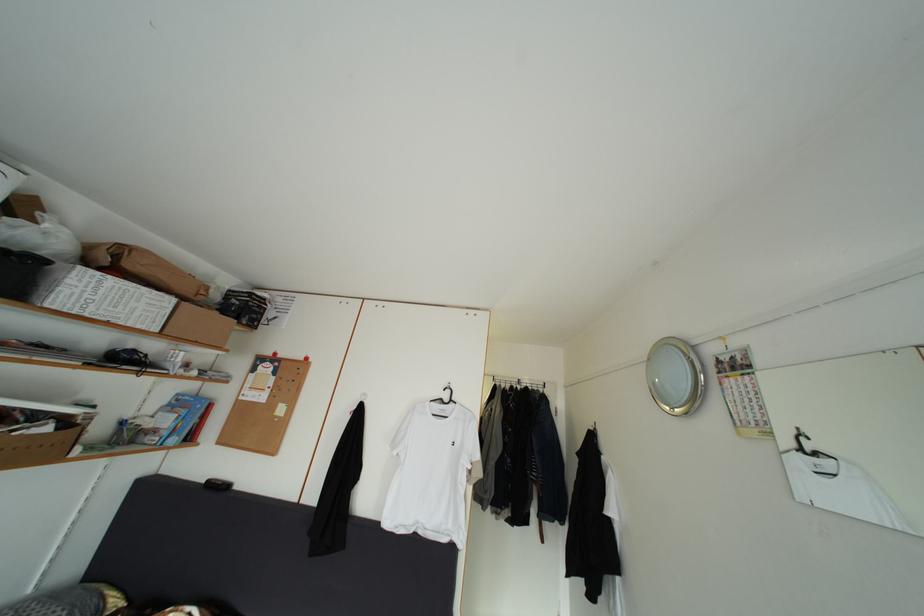
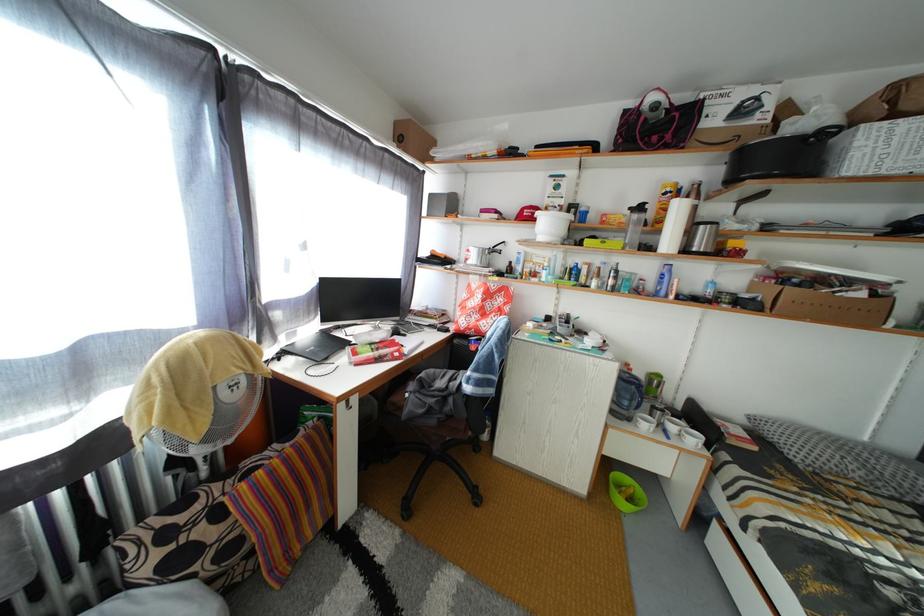
Question: How did the camera likely rotate?

Choices:
 (A) Left
 (B) Right
 (C) Up
 (D) Down

Answer: (A)